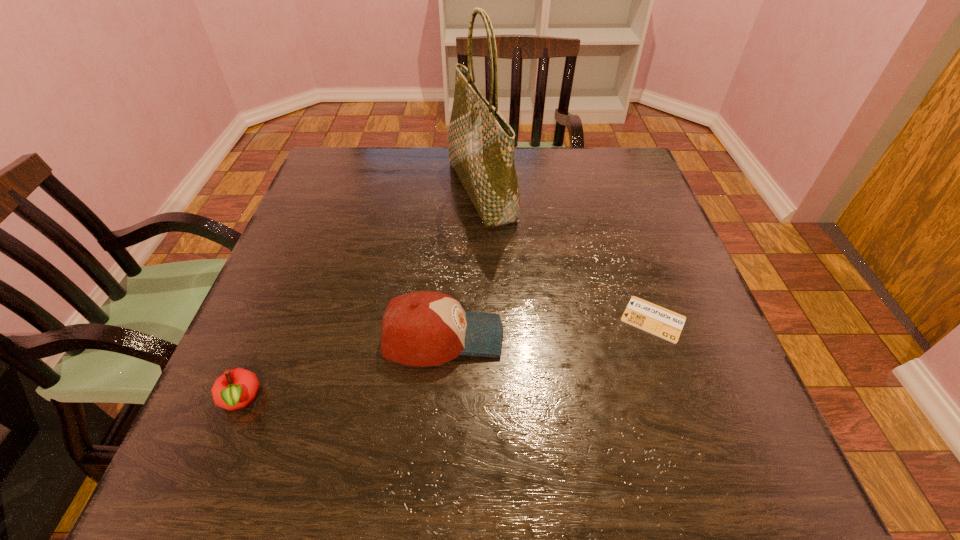
Where is `vacant space at the far right corner`? Image resolution: width=960 pixels, height=540 pixels. vacant space at the far right corner is located at coordinates (605, 157).

What are the coordinates of `vacant space at the near right corner` in the screenshot? It's located at (683, 478).

Locate an element on the screen. The width and height of the screenshot is (960, 540). vacant point located between the apple and the shopping bag is located at coordinates (360, 295).

Where is `free space between the baseball cap and the farthest object`? The height and width of the screenshot is (540, 960). free space between the baseball cap and the farthest object is located at coordinates (462, 264).

I want to click on free spot between the shortest object and the second tallest object, so click(548, 328).

Where is `vacant space that's between the baseball cap and the nearest object`? vacant space that's between the baseball cap and the nearest object is located at coordinates (341, 368).

The image size is (960, 540). I want to click on free space between the identity card and the baseball cap, so click(x=548, y=328).

Image resolution: width=960 pixels, height=540 pixels. In order to click on free space between the baseball cap and the farthest object in this screenshot , I will do `click(462, 264)`.

Where is `free space between the rightmost object and the shopping bag`? The image size is (960, 540). free space between the rightmost object and the shopping bag is located at coordinates (567, 255).

Identify which object is the nearest to the farthest object. Please provide its 2D coordinates. Your answer should be formatted as a tuple, i.e. [(x, y)], where the tuple contains the x and y coordinates of a point satisfying the conditions above.

[(424, 328)]